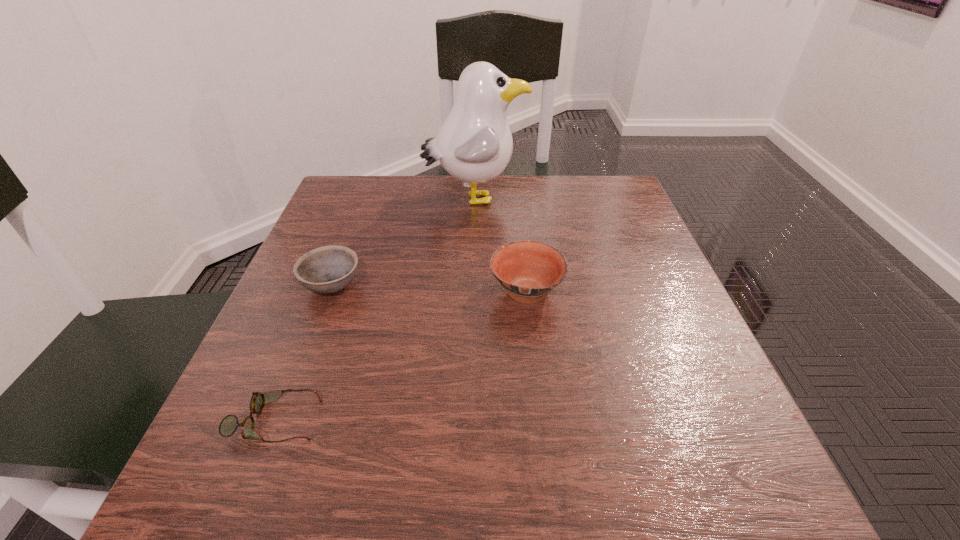
Image resolution: width=960 pixels, height=540 pixels. In order to click on vacant area at the far right corner in this screenshot , I will do [586, 188].

The width and height of the screenshot is (960, 540). In order to click on free space between the nearest object and the third shortest object in this screenshot , I will do `click(400, 356)`.

Identify the location of vacant point located between the third tallest object and the second tallest object. (429, 289).

Identify the location of vacant space in between the tallest object and the third shortest object. (500, 246).

This screenshot has height=540, width=960. In order to click on vacant space in between the tallest object and the nearest object in this screenshot , I will do `click(374, 309)`.

I want to click on unoccupied position between the taller bowl and the tallest object, so click(x=500, y=246).

Find the location of a particular element. This screenshot has height=540, width=960. blank region between the right bowl and the third tallest object is located at coordinates (429, 289).

The width and height of the screenshot is (960, 540). In order to click on free space between the farthest object and the shorter bowl in this screenshot , I will do `click(403, 242)`.

Locate an element on the screen. vacant area that lies between the nearest object and the right bowl is located at coordinates (400, 356).

Locate an element on the screen. free space between the left bowl and the nearest object is located at coordinates (303, 353).